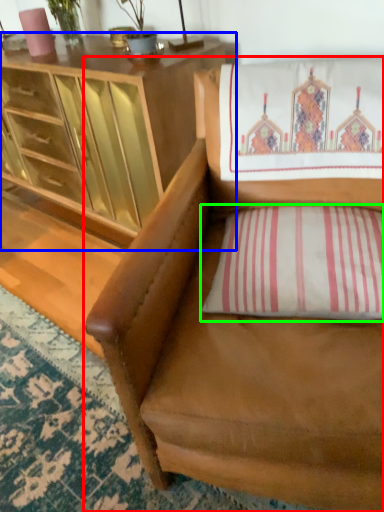
Question: Which object is the farthest from chair (highlighted by a red box)? Choose among these: cabinetry (highlighted by a blue box) or pillow (highlighted by a green box).

Choices:
 (A) cabinetry
 (B) pillow

Answer: (A)